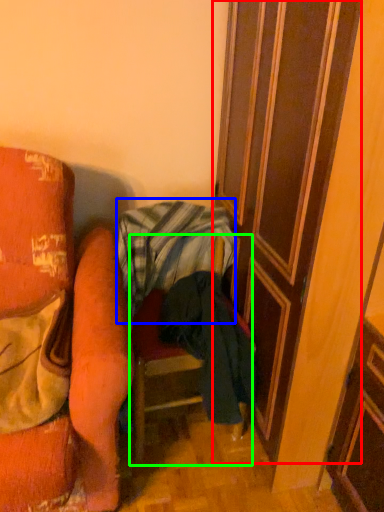
Question: Based on their relative distances, which object is farther from door (highlighted by a red box)? Choose from blanket (highlighted by a blue box) and furniture (highlighted by a green box).

Choices:
 (A) blanket
 (B) furniture

Answer: (B)